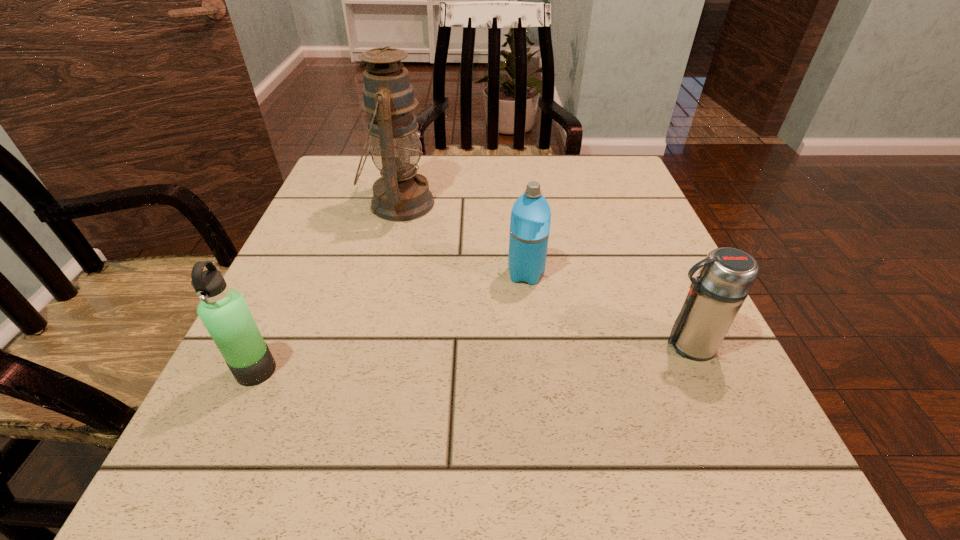
Locate an element on the screen. the farthest object is located at coordinates (401, 194).

The image size is (960, 540). I want to click on the tallest object, so click(x=401, y=194).

The image size is (960, 540). What are the coordinates of `the leftmost object` in the screenshot? It's located at (223, 311).

The image size is (960, 540). Identify the location of the second thermos bottle from left to right. (530, 220).

Identify the location of the third object from left to right. The image size is (960, 540). (530, 220).

I want to click on the rightmost thermos bottle, so click(x=727, y=275).

You are a GUI agent. You are given a task and a screenshot of the screen. Output one action in this format:
    pyautogui.click(x=<x>, y=<y>)
    Task: Click on the vacant space located on the right of the oil lamp
    Image resolution: width=960 pixels, height=540 pixels.
    Given the screenshot: What is the action you would take?
    pyautogui.click(x=606, y=204)

Where is `vacant area situated on the back of the leftmost thermos bottle`? vacant area situated on the back of the leftmost thermos bottle is located at coordinates (300, 276).

Locate an element on the screen. This screenshot has width=960, height=540. free space located on the left of the second thermos bottle from left to right is located at coordinates (476, 274).

You are a GUI agent. You are given a task and a screenshot of the screen. Output one action in this format:
    pyautogui.click(x=<x>, y=<y>)
    Task: Click on the free space located 0.190m with a handle on the side of the rightmost thermos bottle
    This screenshot has width=960, height=540.
    Given the screenshot: What is the action you would take?
    pyautogui.click(x=544, y=345)